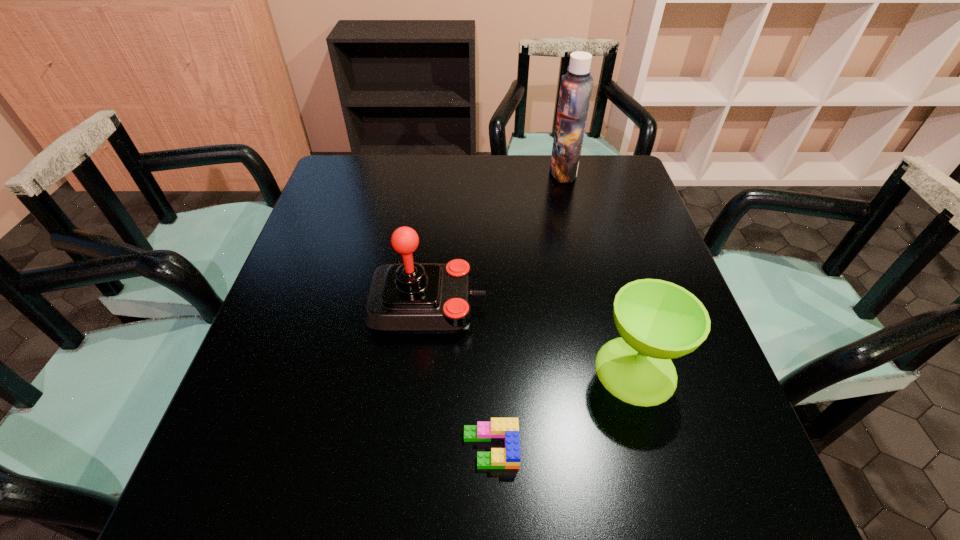
Find the location of `the farthest object`. the farthest object is located at coordinates (576, 85).

In order to click on the tallest object in this screenshot , I will do `click(576, 85)`.

The width and height of the screenshot is (960, 540). I want to click on joystick, so click(406, 298).

Find the location of a particular element. This screenshot has width=960, height=540. the second shortest object is located at coordinates (657, 320).

Locate an element on the screen. This screenshot has height=540, width=960. the nearest object is located at coordinates (506, 430).

This screenshot has height=540, width=960. In order to click on Lego in this screenshot , I will do `click(506, 430)`.

You are a GUI agent. You are given a task and a screenshot of the screen. Output one action in this format:
    pyautogui.click(x=<x>, y=<y>)
    Task: Click on the free location located on the front label of the farthest object
    The width and height of the screenshot is (960, 540).
    Given the screenshot: What is the action you would take?
    pyautogui.click(x=437, y=172)

I want to click on blank space located on the front label of the farthest object, so coord(431,172).

The width and height of the screenshot is (960, 540). I want to click on free space located on the front label of the farthest object, so click(489, 172).

At what (x,y) coordinates should I click in order to perform the action: click on blank space located 0.260m on the base of the second tallest object. Please return your answer as a coordinate pair (x, y). The height and width of the screenshot is (540, 960). Looking at the image, I should click on (600, 305).